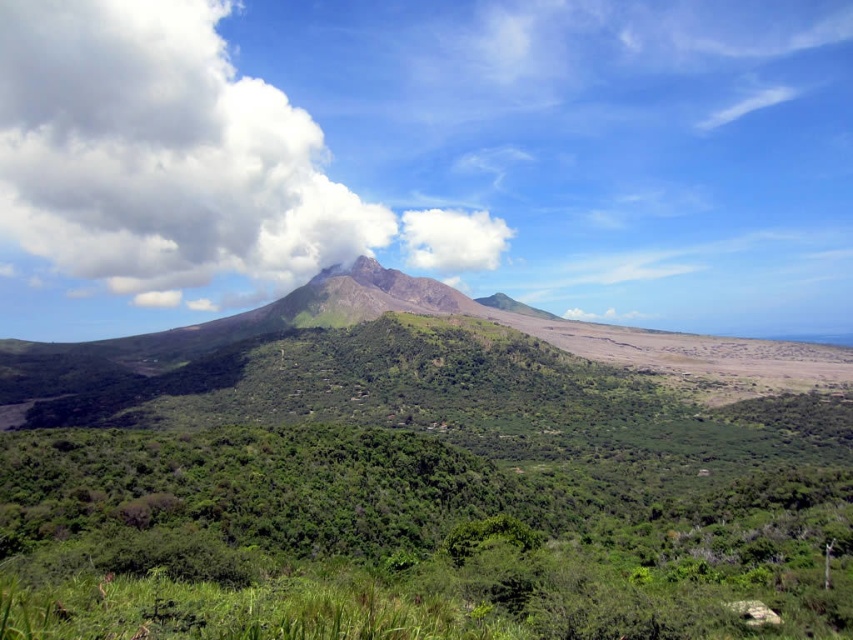
Question: Which object appears closest to the camera in this image?

Choices:
 (A) white fluffy cloud at upper left
 (B) green leafy vegetation at center

Answer: (B)

Question: Is green leafy vegetation at center above white fluffy cloud at upper left?

Choices:
 (A) no
 (B) yes

Answer: (A)

Question: Does green leafy vegetation at center have a lesser width compared to white fluffy cloud at upper left?

Choices:
 (A) yes
 (B) no

Answer: (A)

Question: Which of the following is the closest to the observer?

Choices:
 (A) white fluffy cloud at upper left
 (B) green leafy vegetation at center

Answer: (B)

Question: Observing the image, what is the correct spatial positioning of green leafy vegetation at center in reference to white fluffy cloud at upper left?

Choices:
 (A) right
 (B) left

Answer: (A)